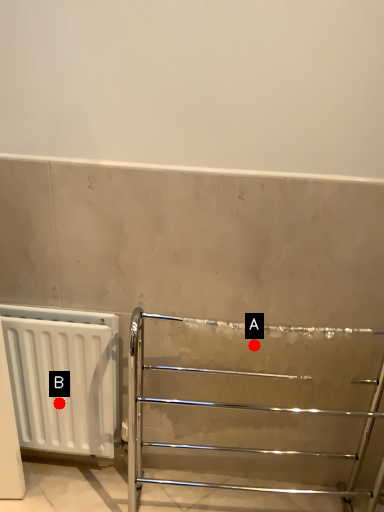
Question: Two points are circled on the image, labeled by A and B beside each circle. Which point appears closest to the camera in this image?

Choices:
 (A) A is closer
 (B) B is closer

Answer: (A)